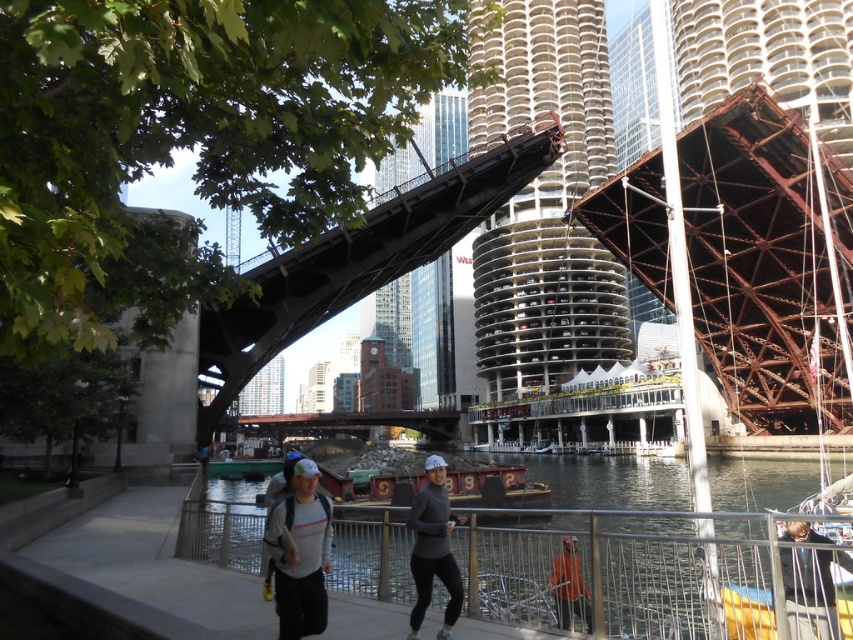
You are a delivery drone operator who needs to fly your drone from the clear water at lower center to the matte black leggings at center. What is the minimum horizontal distance you need to cover?

The minimum horizontal distance between the clear water at lower center and the matte black leggings at center is 8.28 meters.

You are a photographer standing on the walkway and want to take a photo of the dark gray fabric jacket at lower right and the orange fabric at lower right. Which object will appear closer to the camera in the photo?

The dark gray fabric jacket at lower right will appear closer to the camera because it is in front of the orange fabric at lower right.

You are a pedestrian standing on the walkway and see two items at the lower right corner of your view. Which one is more to the right between the dark gray fabric jacket at lower right and the orange fabric at lower right?

The dark gray fabric jacket at lower right is more to the right because it is positioned on the right side of orange fabric at lower right.